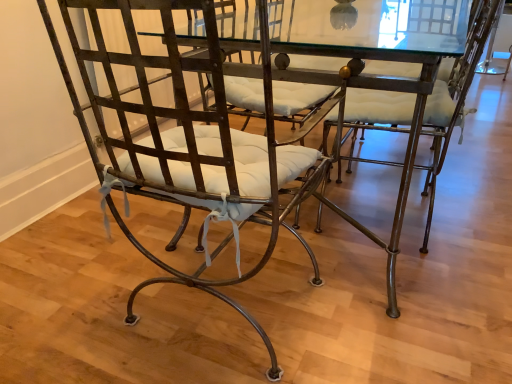
Question: Is matte metal chair at center, which appears as the 1th chair when viewed from the left, aimed at matte metal chair at center, the second chair viewed from the left?

Choices:
 (A) yes
 (B) no

Answer: (B)

Question: Does matte metal chair at center, which ranks as the second chair in right-to-left order, have a larger size compared to matte metal chair at center, the second chair viewed from the left?

Choices:
 (A) yes
 (B) no

Answer: (A)

Question: Considering the relative positions of matte metal chair at center, which appears as the 1th chair when viewed from the left, and matte metal chair at center, the second chair viewed from the left, in the image provided, is matte metal chair at center, which appears as the 1th chair when viewed from the left, to the left of matte metal chair at center, the second chair viewed from the left, from the viewer's perspective?

Choices:
 (A) yes
 (B) no

Answer: (A)

Question: Would you consider matte metal chair at center, which appears as the 1th chair when viewed from the left, to be distant from matte metal chair at center, the second chair viewed from the left?

Choices:
 (A) no
 (B) yes

Answer: (A)

Question: Considering the relative sizes of matte metal chair at center, which appears as the 1th chair when viewed from the left, and matte metal chair at center, placed as the first chair when sorted from right to left, in the image provided, is matte metal chair at center, which appears as the 1th chair when viewed from the left, wider than matte metal chair at center, placed as the first chair when sorted from right to left,?

Choices:
 (A) no
 (B) yes

Answer: (B)

Question: Considering the positions of point (261, 336) and point (450, 117), is point (261, 336) closer or farther from the camera than point (450, 117)?

Choices:
 (A) closer
 (B) farther

Answer: (A)

Question: Visually, is matte metal chair at center, which appears as the 1th chair when viewed from the left, positioned to the left or to the right of matte metal chair at center, placed as the first chair when sorted from right to left?

Choices:
 (A) right
 (B) left

Answer: (B)

Question: From a real-world perspective, relative to matte metal chair at center, the second chair viewed from the left, is matte metal chair at center, which ranks as the second chair in right-to-left order, vertically above or below?

Choices:
 (A) below
 (B) above

Answer: (B)

Question: From the image's perspective, relative to matte metal chair at center, the second chair viewed from the left, is matte metal chair at center, which appears as the 1th chair when viewed from the left, above or below?

Choices:
 (A) above
 (B) below

Answer: (B)

Question: Considering their positions, is glass transparent table at center located in front of or behind matte metal chair at center, placed as the first chair when sorted from right to left?

Choices:
 (A) behind
 (B) front

Answer: (B)

Question: From a real-world perspective, is glass transparent table at center above or below matte metal chair at center, the second chair viewed from the left?

Choices:
 (A) above
 (B) below

Answer: (B)

Question: Is point (413, 122) positioned closer to the camera than point (460, 114)?

Choices:
 (A) farther
 (B) closer

Answer: (B)

Question: Looking at the image, does glass transparent table at center seem bigger or smaller compared to matte metal chair at center, placed as the first chair when sorted from right to left?

Choices:
 (A) small
 (B) big

Answer: (B)

Question: Considering the positions of point (271, 41) and point (78, 107), is point (271, 41) closer or farther from the camera than point (78, 107)?

Choices:
 (A) closer
 (B) farther

Answer: (B)

Question: In terms of height, does glass transparent table at center look taller or shorter compared to matte metal chair at center, which appears as the 1th chair when viewed from the left?

Choices:
 (A) tall
 (B) short

Answer: (B)